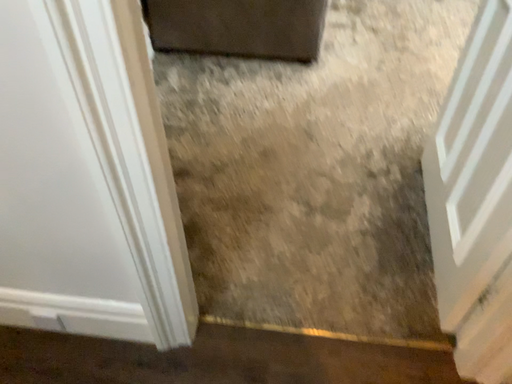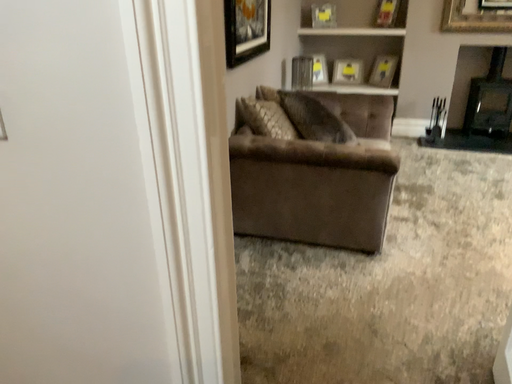
Question: How did the camera likely rotate when shooting the video?

Choices:
 (A) rotated right
 (B) rotated left

Answer: (B)